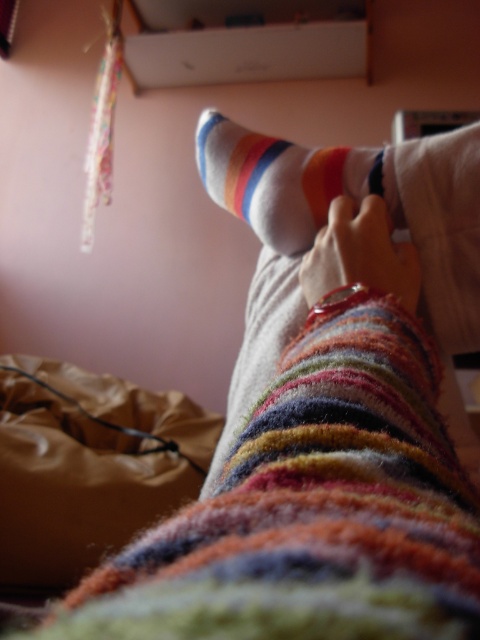
Question: Is white striped sock at center further to the viewer compared to multicolored fuzzy socks at center?

Choices:
 (A) yes
 (B) no

Answer: (A)

Question: Does multicolored fuzzy socks at center have a smaller size compared to matte striped sock at center?

Choices:
 (A) yes
 (B) no

Answer: (B)

Question: Based on their relative distances, which object is nearer to the white striped sock at center?

Choices:
 (A) matte striped sock at center
 (B) multicolored fuzzy socks at center

Answer: (B)

Question: Which point is farther to the camera?

Choices:
 (A) multicolored fuzzy socks at center
 (B) white striped sock at center
 (C) matte striped sock at center

Answer: (B)

Question: Does multicolored fuzzy socks at center lie behind matte striped sock at center?

Choices:
 (A) no
 (B) yes

Answer: (A)

Question: Which object is farther from the camera taking this photo?

Choices:
 (A) matte striped sock at center
 (B) white striped sock at center
 (C) multicolored fuzzy socks at center

Answer: (B)